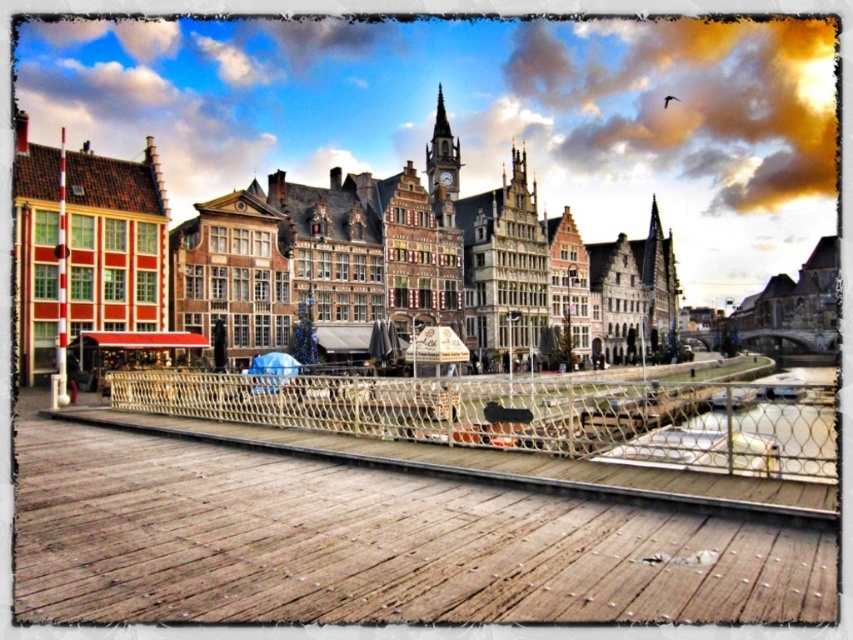
You are a painter setting up your easel on the weathered wood dock at lower center. You want to paint the metallic mesh rail at center. Which object is narrower in width?

The weathered wood dock at lower center is narrower in width compared to the metallic mesh rail at center.

You are standing on the wooden dock at the lower center of the image. You see a point marked at coordinates (375, 544). Based on the scene description, can you determine what surface this point is located on?

The point at coordinates (375, 544) is on the weathered wood dock at lower center.